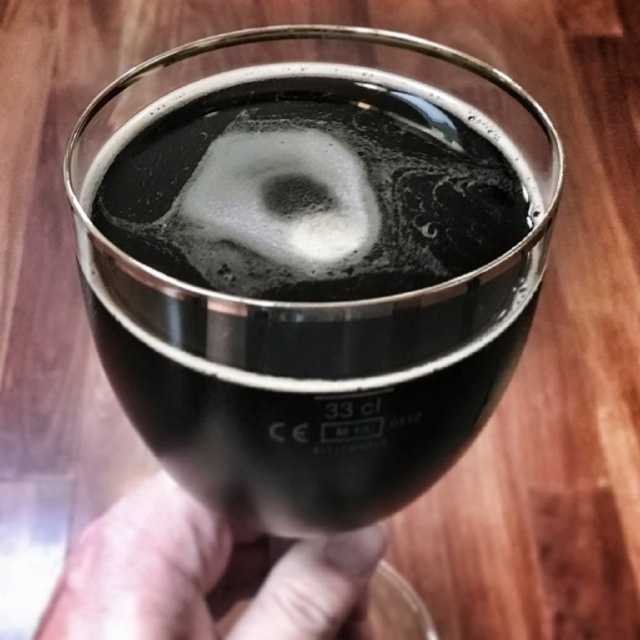
Does shiny black glass at center have a greater width compared to white frothy foam at center?

Yes, shiny black glass at center is wider than white frothy foam at center.

Is shiny black glass at center smaller than white frothy foam at center?

No.

Measure the distance between point [273,477] and camera.

Point [273,477] is 6.70 inches from camera.

I want to click on shiny black glass at center, so click(307, 317).

Between skinny white hand at lower center and white frothy foam at center, which one is positioned lower?

skinny white hand at lower center

At what (x,y) coordinates should I click in order to perform the action: click on skinny white hand at lower center. Please return your answer as a coordinate pair (x, y). The height and width of the screenshot is (640, 640). Looking at the image, I should click on (208, 576).

What do you see at coordinates (208, 576) in the screenshot? The width and height of the screenshot is (640, 640). I see `skinny white hand at lower center` at bounding box center [208, 576].

The image size is (640, 640). What are the coordinates of `skinny white hand at lower center` in the screenshot? It's located at (208, 576).

Which of these two, shiny black glass at center or skinny white hand at lower center, stands taller?

shiny black glass at center

Does point (292, 33) come in front of point (278, 627)?

No, it is behind (278, 627).

Find the location of a particular element. This screenshot has width=640, height=640. shiny black glass at center is located at coordinates (307, 317).